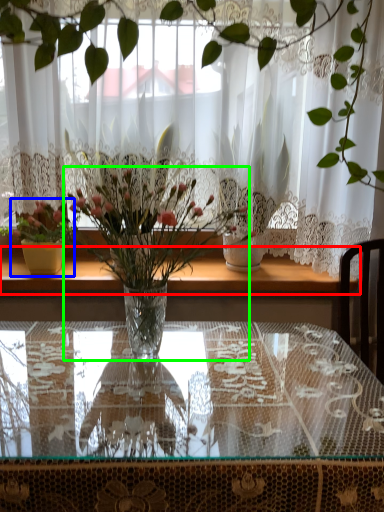
Question: Which object is positioned farthest from window sill (highlighted by a red box)? Select from houseplant (highlighted by a blue box) and houseplant (highlighted by a green box).

Choices:
 (A) houseplant
 (B) houseplant

Answer: (B)